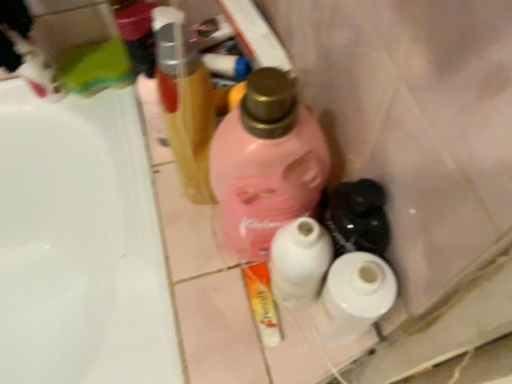
Question: Is there a large distance between metallic gold hairbrush at upper center, which appears as the 1th bottle when viewed from the left, and white glossy tube at center?

Choices:
 (A) yes
 (B) no

Answer: (B)

Question: Is metallic gold hairbrush at upper center, which appears as the 1th bottle when viewed from the left, located outside white glossy tube at center?

Choices:
 (A) no
 (B) yes

Answer: (B)

Question: Can you confirm if metallic gold hairbrush at upper center, the second bottle positioned from the right, is wider than white glossy tube at center?

Choices:
 (A) no
 (B) yes

Answer: (B)

Question: Does metallic gold hairbrush at upper center, the second bottle positioned from the right, have a lesser height compared to white glossy tube at center?

Choices:
 (A) no
 (B) yes

Answer: (A)

Question: Could white glossy tube at center be considered to be inside metallic gold hairbrush at upper center, which appears as the 1th bottle when viewed from the left?

Choices:
 (A) no
 (B) yes

Answer: (A)

Question: Looking at their shapes, would you say pink matte bottle at center, which is the 1th bottle from right to left, is wider or thinner than white matte toilet paper at center, acting as the 2th toilet paper starting from the right?

Choices:
 (A) wide
 (B) thin

Answer: (A)

Question: From a real-world perspective, is pink matte bottle at center, positioned as the 2th bottle in left-to-right order, above or below white matte toilet paper at center, the 1th toilet paper when ordered from left to right?

Choices:
 (A) above
 (B) below

Answer: (A)

Question: In terms of height, does pink matte bottle at center, positioned as the 2th bottle in left-to-right order, look taller or shorter compared to white matte toilet paper at center, the 1th toilet paper when ordered from left to right?

Choices:
 (A) tall
 (B) short

Answer: (A)

Question: Would you say pink matte bottle at center, positioned as the 2th bottle in left-to-right order, is to the left or to the right of white matte toilet paper at center, the 1th toilet paper when ordered from left to right, in the picture?

Choices:
 (A) left
 (B) right

Answer: (A)

Question: Considering the relative positions of white matte toilet paper at center, acting as the first toilet paper starting from the right, and white glossy tube at center in the image provided, is white matte toilet paper at center, acting as the first toilet paper starting from the right, to the left or to the right of white glossy tube at center?

Choices:
 (A) left
 (B) right

Answer: (B)

Question: From the image's perspective, is white matte toilet paper at center, which is the 2th toilet paper from left to right, positioned above or below white glossy tube at center?

Choices:
 (A) above
 (B) below

Answer: (A)

Question: Is white matte toilet paper at center, which is the 2th toilet paper from left to right, wider or thinner than white glossy tube at center?

Choices:
 (A) wide
 (B) thin

Answer: (A)

Question: Looking at the image, does white matte toilet paper at center, acting as the first toilet paper starting from the right, seem bigger or smaller compared to white glossy tube at center?

Choices:
 (A) big
 (B) small

Answer: (A)

Question: Considering the relative positions of white glossy sink at left and white glossy tube at center in the image provided, is white glossy sink at left to the left or to the right of white glossy tube at center?

Choices:
 (A) right
 (B) left

Answer: (B)

Question: Considering their positions, is white glossy sink at left located in front of or behind white glossy tube at center?

Choices:
 (A) front
 (B) behind

Answer: (A)